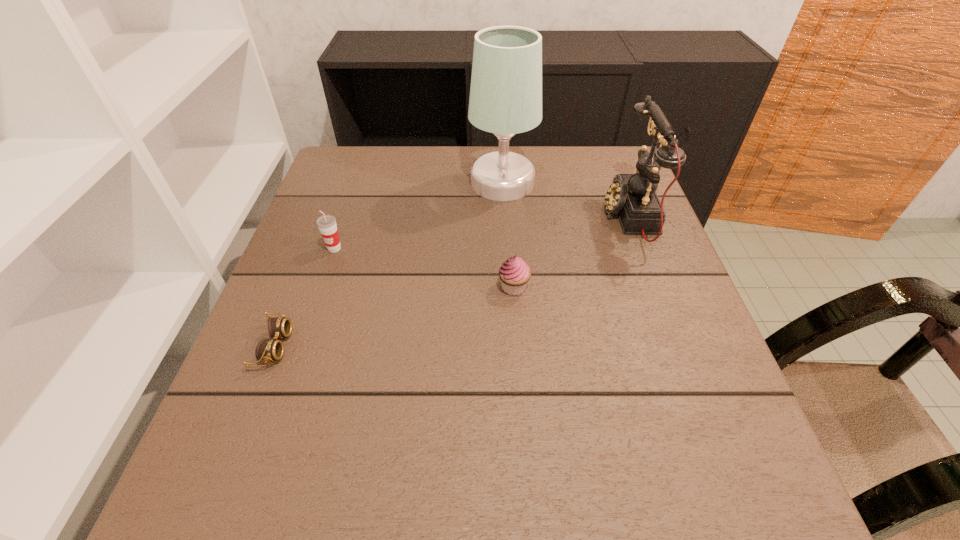
Where is `vacant region located on the base of the tallest object`? vacant region located on the base of the tallest object is located at coordinates (337, 183).

Locate an element on the screen. vacant position located on the base of the tallest object is located at coordinates (432, 183).

You are a GUI agent. You are given a task and a screenshot of the screen. Output one action in this format:
    pyautogui.click(x=<x>, y=<y>)
    Task: Click on the vacant space located 0.160m on the dial of the telephone
    
    Given the screenshot: What is the action you would take?
    (x=540, y=217)

Locate an element on the screen. The image size is (960, 540). free region located on the dial of the telephone is located at coordinates (531, 217).

Where is `vacant area located 0.210m on the dial of the telephone`? Image resolution: width=960 pixels, height=540 pixels. vacant area located 0.210m on the dial of the telephone is located at coordinates pos(519,217).

Image resolution: width=960 pixels, height=540 pixels. Identify the location of free space located 0.290m on the side of the cup with the logo. (294, 368).

You are a GUI agent. You are given a task and a screenshot of the screen. Output one action in this format:
    pyautogui.click(x=<x>, y=<y>)
    Task: Click on the vacant space located 0.300m on the left of the fourth tallest object
    The width and height of the screenshot is (960, 540).
    Given the screenshot: What is the action you would take?
    pyautogui.click(x=352, y=287)

Identify the location of free region located 0.220m through the lenses of the leftmost object. Image resolution: width=960 pixels, height=540 pixels. (409, 346).

In order to click on lampshade that is at the far edge in this screenshot , I will do `click(505, 99)`.

Where is `telephone that is at the far edge`? The image size is (960, 540). telephone that is at the far edge is located at coordinates (633, 197).